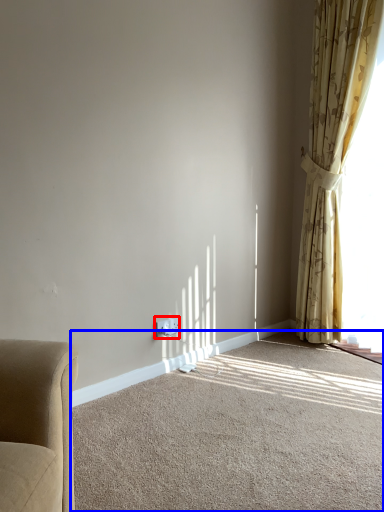
Question: Which of the following is the closest to the observer, electric outlet (highlighted by a red box) or plain (highlighted by a blue box)?

Choices:
 (A) electric outlet
 (B) plain

Answer: (B)